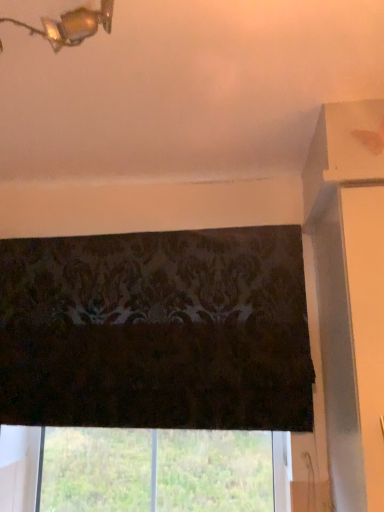
This screenshot has width=384, height=512. What do you see at coordinates (156, 470) in the screenshot?
I see `transparent glass window at lower center` at bounding box center [156, 470].

Measure the distance between point (55,432) and camera.

A distance of 4.74 feet exists between point (55,432) and camera.

Image resolution: width=384 pixels, height=512 pixels. Find the location of `transparent glass window at lower center`. transparent glass window at lower center is located at coordinates click(x=156, y=470).

The height and width of the screenshot is (512, 384). In order to click on transparent glass window at lower center in this screenshot , I will do `click(156, 470)`.